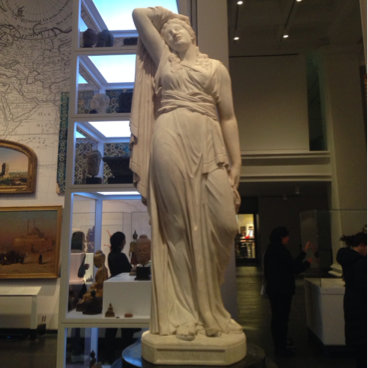
You are a GUI agent. You are given a task and a screenshot of the screen. Output one action in this format:
    pyautogui.click(x=<x>, y=<y>)
    Task: Click on the wall (painting of map)
    Image resolution: width=368 pixels, height=368 pixels.
    Given the screenshot: What is the action you would take?
    pyautogui.click(x=27, y=48)